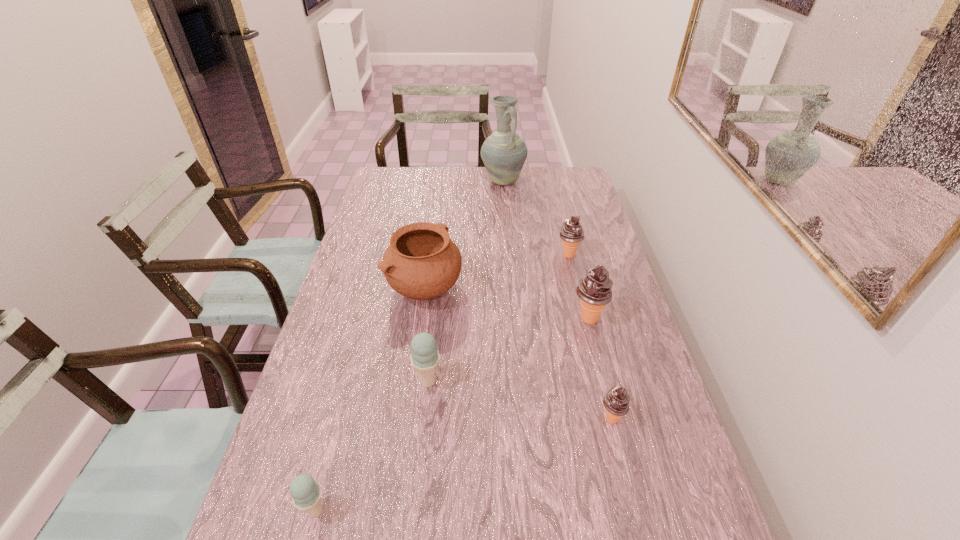
Image resolution: width=960 pixels, height=540 pixels. I want to click on free point that satisfies the following two spatial constraints: 1. on the front side of the third nearest ice cream; 2. on the right side of the pottery, so click(x=413, y=381).

Locate an element on the screen. This screenshot has height=540, width=960. vacant position in the image that satisfies the following two spatial constraints: 1. on the handle side of the tallest object; 2. on the left side of the tallest ice cream is located at coordinates (514, 319).